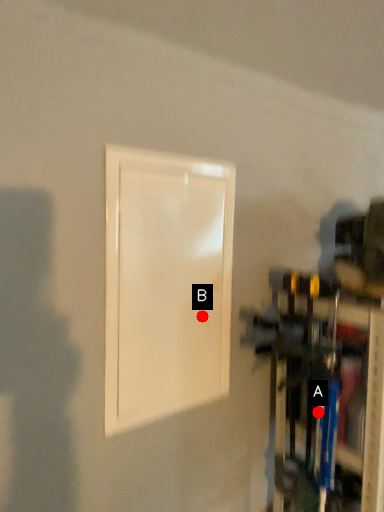
Question: Two points are circled on the image, labeled by A and B beside each circle. Among these points, which one is nearest to the camera?

Choices:
 (A) A is closer
 (B) B is closer

Answer: (A)